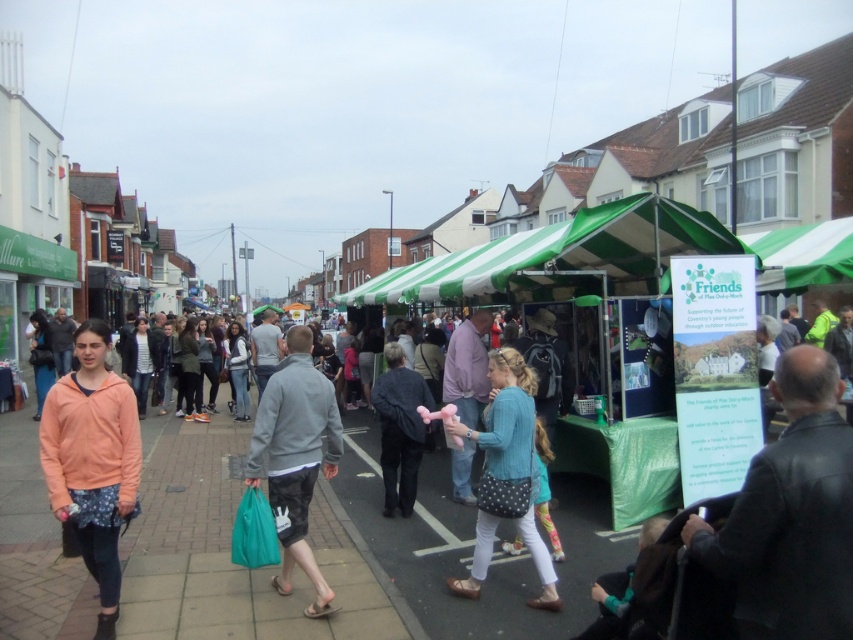
You are a photographer standing at the camera position in the street market scene. You want to capture a photo of the leather jacket at lower right without moving. Can you reach it with your camera lens that has a 2 meter maximum focus distance?

The leather jacket at lower right is 2.39 meters away from camera. Since the maximum focus distance is 2 meters, the camera cannot focus on the leather jacket at lower right as it is beyond the lens capability.

You are a person standing at the center of the street market. You see a gray fabric jacket at center. Is the point at coordinate (x=294, y=456) located on the gray fabric jacket at center?

Yes, the point at coordinate (x=294, y=456) is located on the gray fabric jacket at center.

You are a shopper at the market and want to try on both the matte peach hoodie at center and the blue knitted sweater at center. Which one should you take off first if you want to try them on one at a time?

The matte peach hoodie at center is positioned over the blue knitted sweater at center, so you should take off the matte peach hoodie at center first to access the blue knitted sweater at center.